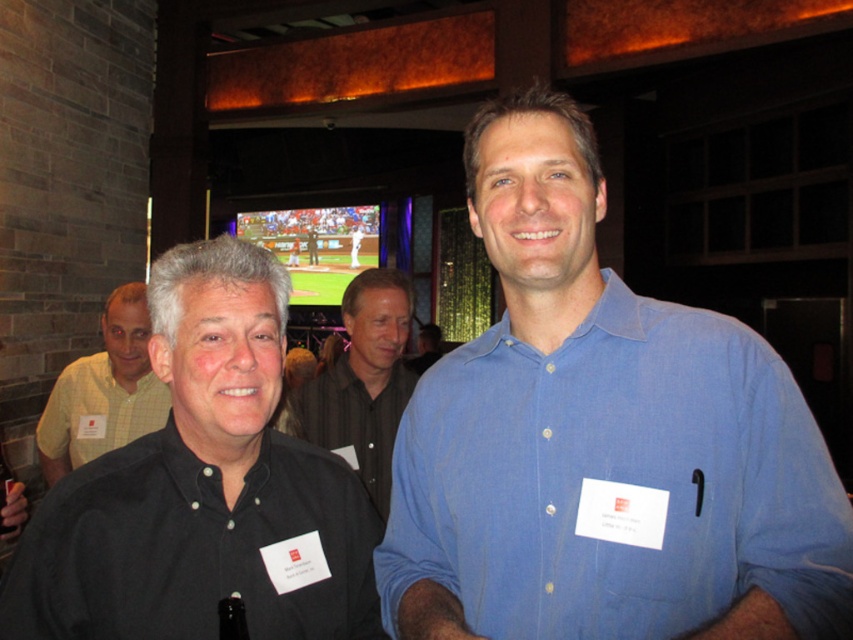
Question: Which object is positioned closest to the black matte shirt at center?

Choices:
 (A) black shirt at center
 (B) blue cotton shirt at center
 (C) checkered fabric shirt at left

Answer: (B)

Question: Is black matte shirt at center above checkered fabric shirt at left?

Choices:
 (A) no
 (B) yes

Answer: (B)

Question: Among these points, which one is nearest to the camera?

Choices:
 (A) (370, 420)
 (B) (474, 384)
 (C) (28, 547)
 (D) (48, 480)

Answer: (C)

Question: Which object is the closest to the black matte shirt at center?

Choices:
 (A) black shirt at center
 (B) blue cotton shirt at center
 (C) checkered fabric shirt at left

Answer: (B)

Question: Does black matte shirt at center appear on the right side of black shirt at center?

Choices:
 (A) yes
 (B) no

Answer: (A)

Question: Can you confirm if black matte shirt at center is smaller than checkered fabric shirt at left?

Choices:
 (A) yes
 (B) no

Answer: (A)